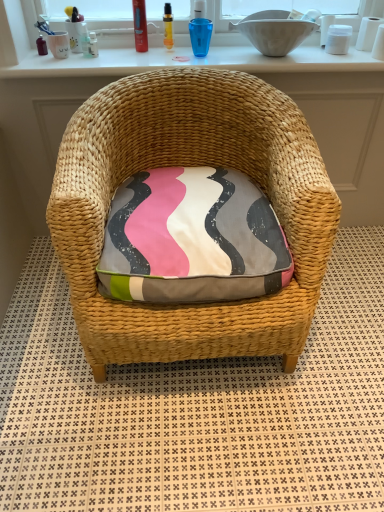
Where is `free region on the left part of shiny red can at upper center, marked as the second toiletry in a left-to-right arrangement`? free region on the left part of shiny red can at upper center, marked as the second toiletry in a left-to-right arrangement is located at coordinates (104, 55).